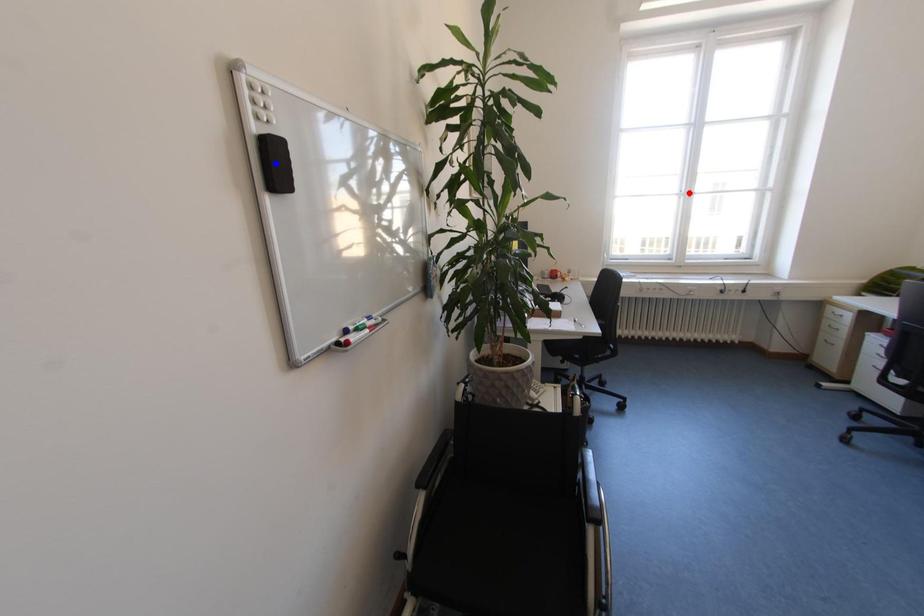
Question: Two points are marked on the image. Which point is closer to the camera?

Choices:
 (A) Blue point is closer.
 (B) Red point is closer.

Answer: (A)